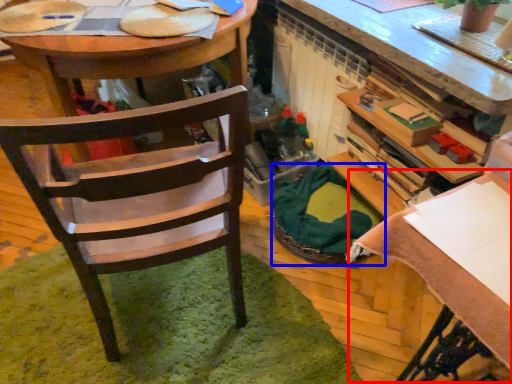
Question: Which object appears farthest to the camera in this image, table (highlighted by a red box) or picnic basket (highlighted by a blue box)?

Choices:
 (A) table
 (B) picnic basket

Answer: (B)